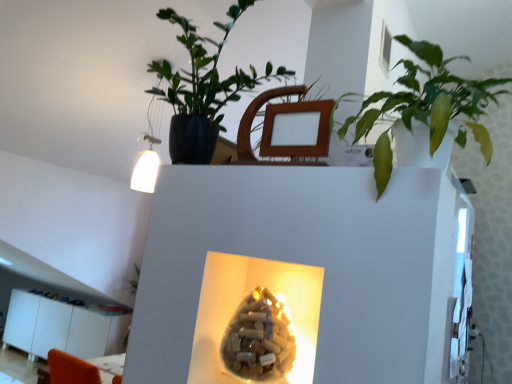
Question: Should I look upward or downward to see wooden swivel chair at upper center?

Choices:
 (A) down
 (B) up

Answer: (B)

Question: Is white glossy cabinet at lower left positioned before green glossy leafy plant at upper right, marked as the second houseplant in a left-to-right arrangement?

Choices:
 (A) yes
 (B) no

Answer: (B)

Question: From the image's perspective, does white glossy cabinet at lower left appear higher than green glossy leafy plant at upper right, marked as the second houseplant in a left-to-right arrangement?

Choices:
 (A) yes
 (B) no

Answer: (B)

Question: Would you say white glossy cabinet at lower left is outside green glossy leafy plant at upper right, marked as the second houseplant in a left-to-right arrangement?

Choices:
 (A) yes
 (B) no

Answer: (A)

Question: Could green glossy leafy plant at upper right, marked as the second houseplant in a left-to-right arrangement, be considered to be inside white glossy cabinet at lower left?

Choices:
 (A) yes
 (B) no

Answer: (B)

Question: Considering the relative positions of white glossy cabinet at lower left and green glossy leafy plant at upper right, which is the first houseplant from right to left, in the image provided, is white glossy cabinet at lower left to the right of green glossy leafy plant at upper right, which is the first houseplant from right to left, from the viewer's perspective?

Choices:
 (A) no
 (B) yes

Answer: (A)

Question: Is white glossy cabinet at lower left next to green glossy leafy plant at upper right, marked as the second houseplant in a left-to-right arrangement, and touching it?

Choices:
 (A) no
 (B) yes

Answer: (A)

Question: Is matte black pot at upper center, the first houseplant when ordered from left to right, further to the viewer compared to green glossy leafy plant at upper right, marked as the second houseplant in a left-to-right arrangement?

Choices:
 (A) yes
 (B) no

Answer: (A)

Question: From a real-world perspective, is matte black pot at upper center, the first houseplant when ordered from left to right, positioned under green glossy leafy plant at upper right, which is the first houseplant from right to left, based on gravity?

Choices:
 (A) yes
 (B) no

Answer: (B)

Question: Can you confirm if matte black pot at upper center, which appears as the second houseplant when viewed from the right, is positioned to the right of green glossy leafy plant at upper right, which is the first houseplant from right to left?

Choices:
 (A) no
 (B) yes

Answer: (A)

Question: Is matte black pot at upper center, the first houseplant when ordered from left to right, in contact with green glossy leafy plant at upper right, which is the first houseplant from right to left?

Choices:
 (A) no
 (B) yes

Answer: (A)

Question: From a real-world perspective, is matte black pot at upper center, the first houseplant when ordered from left to right, on green glossy leafy plant at upper right, marked as the second houseplant in a left-to-right arrangement?

Choices:
 (A) yes
 (B) no

Answer: (A)

Question: Is matte black pot at upper center, the first houseplant when ordered from left to right, closer to the viewer compared to green glossy leafy plant at upper right, marked as the second houseplant in a left-to-right arrangement?

Choices:
 (A) no
 (B) yes

Answer: (A)

Question: Can we say translucent beige vase at center lies outside matte black pot at upper center, the first houseplant when ordered from left to right?

Choices:
 (A) yes
 (B) no

Answer: (A)